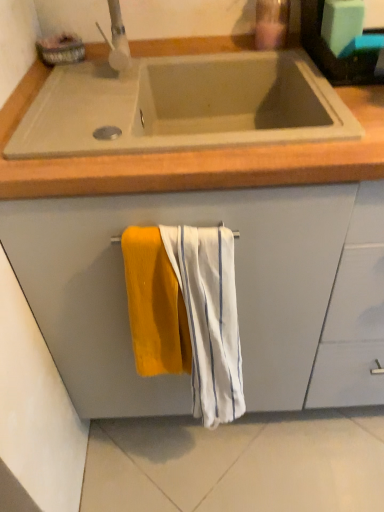
Question: From the image's perspective, relative to white textured towel at center, the second beach towel when ordered from left to right, is beige concrete sink at upper center above or below?

Choices:
 (A) below
 (B) above

Answer: (B)

Question: In terms of height, does beige concrete sink at upper center look taller or shorter compared to white textured towel at center, the second beach towel when ordered from left to right?

Choices:
 (A) tall
 (B) short

Answer: (B)

Question: Which object is the farthest from the beige concrete sink at upper center?

Choices:
 (A) soft yellow towel at center, positioned as the 1th beach towel in left-to-right order
 (B) translucent plastic soap dispenser at upper center
 (C) matte gray cabinet at center
 (D) white textured towel at center, the 1th beach towel in the right-to-left sequence

Answer: (B)

Question: Considering the real-world distances, which object is closest to the translucent plastic soap dispenser at upper center?

Choices:
 (A) beige concrete sink at upper center
 (B) matte gray cabinet at center
 (C) white textured towel at center, the second beach towel when ordered from left to right
 (D) soft yellow towel at center, positioned as the 1th beach towel in left-to-right order

Answer: (A)